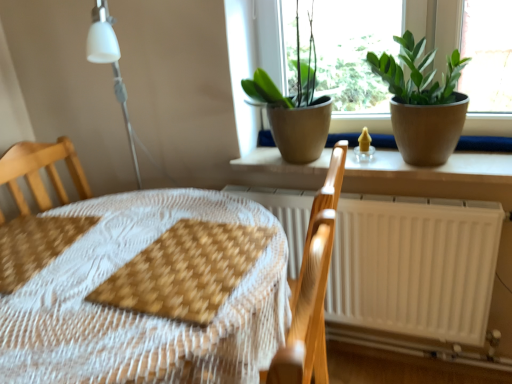
Locate an element on the screen. vacant location below brown woven placemat at center, which is the first sheet in right-to-left order (from a real-world perspective) is located at coordinates (205, 250).